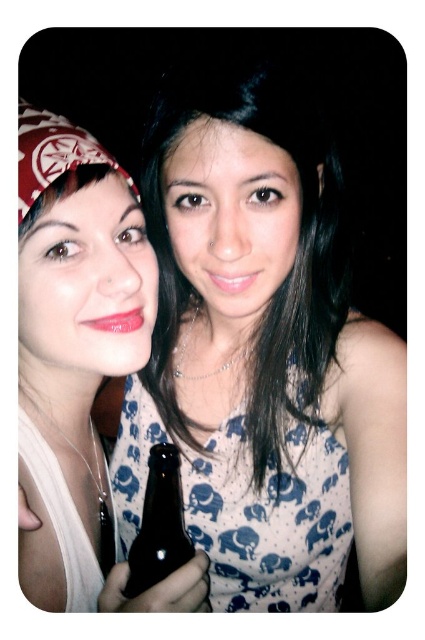
You are a photographer trying to position two subjects for a photo shoot. The scene requires the person wearing a matte white tank top at left to stand exactly at point [73,324]. Can you confirm if the current positioning of the matte white tank top at left matches the required coordinates?

Yes, the matte white tank top at left is already positioned at point [73,324] as required.

You are a photographer setting up a lighting setup for a photo shoot. You have a matte white dress at center and a dark glass bottle at center in the frame. Which object should you adjust the lighting to highlight more, considering one is wider than the other?

The matte white dress at center might be wider than dark glass bottle at center, so you should adjust the lighting to highlight the matte white dress at center more because wider objects often require more focused lighting to ensure they are properly illuminated and detailed.

You are a photographer setting up a photo shoot. You have two white items of clothing in the scene, a matte white dress at center and a matte white tank top at left. The client wants to know if there is enough space between them for a small accessory. The accessory requires at least 6 inches of space. Can the accessory fit between the two items?

The distance between the matte white dress at center and the matte white tank top at left is 6.87 inches, which is more than the required 6 inches. Therefore, the accessory can fit between them.